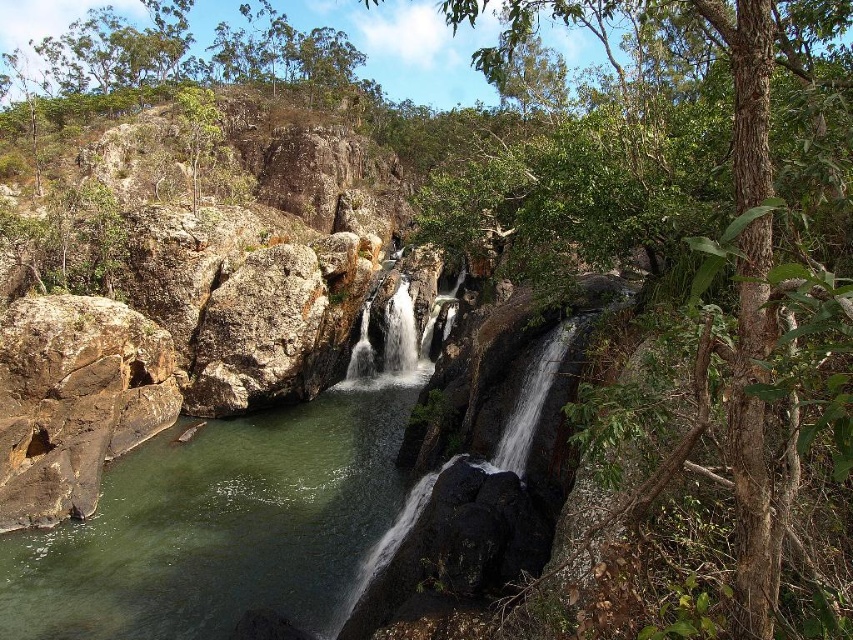
You are standing at the center of the image and see a point marked at coordinates (x=74, y=401). Based on the scene description, what object is located at that point?

The point at coordinates (x=74, y=401) corresponds to a brown rough rock at left.